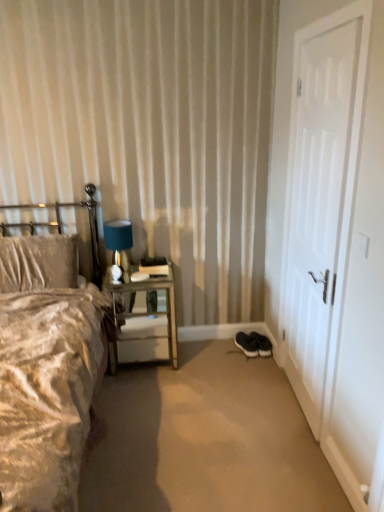
The width and height of the screenshot is (384, 512). What are the coordinates of `vacant area that is in front of black suede sneakers at lower right, arranged as the 2th footwear when viewed from the right` in the screenshot? It's located at (250, 362).